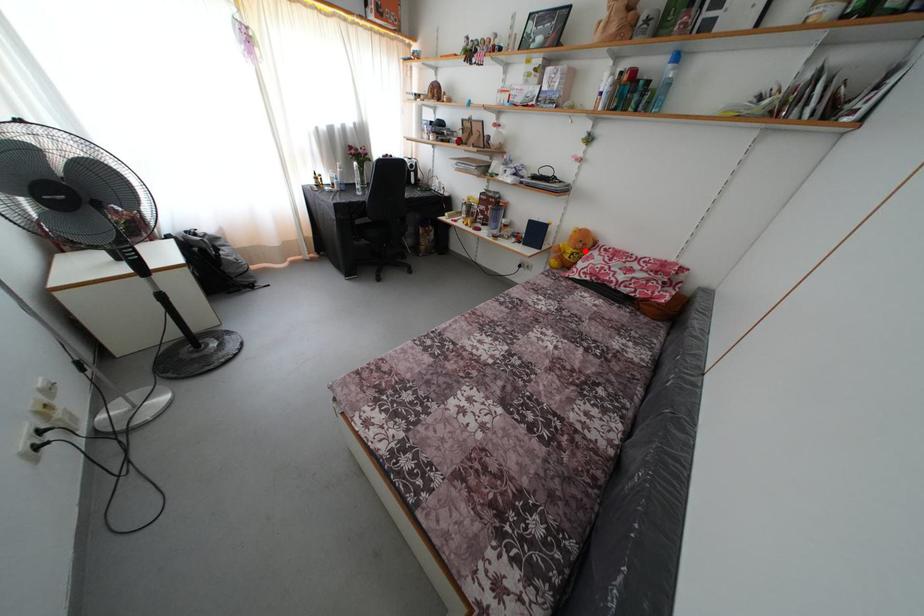
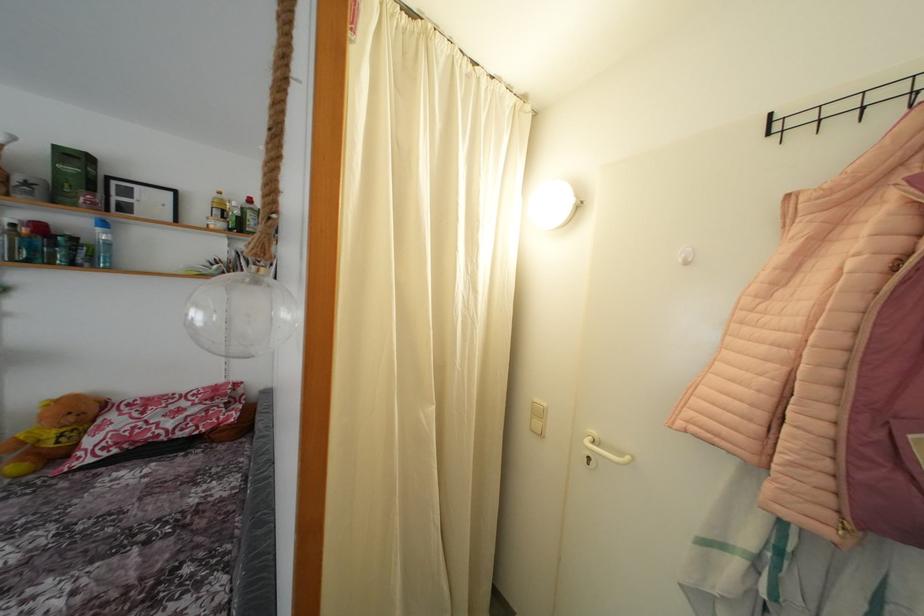
Question: I am providing you with two images of the same scene from different viewpoints. A red point is shown in image1. For the corresponding object point in image2, is it positioned nearer or farther from the camera?

Choices:
 (A) Nearer
 (B) Farther

Answer: (B)